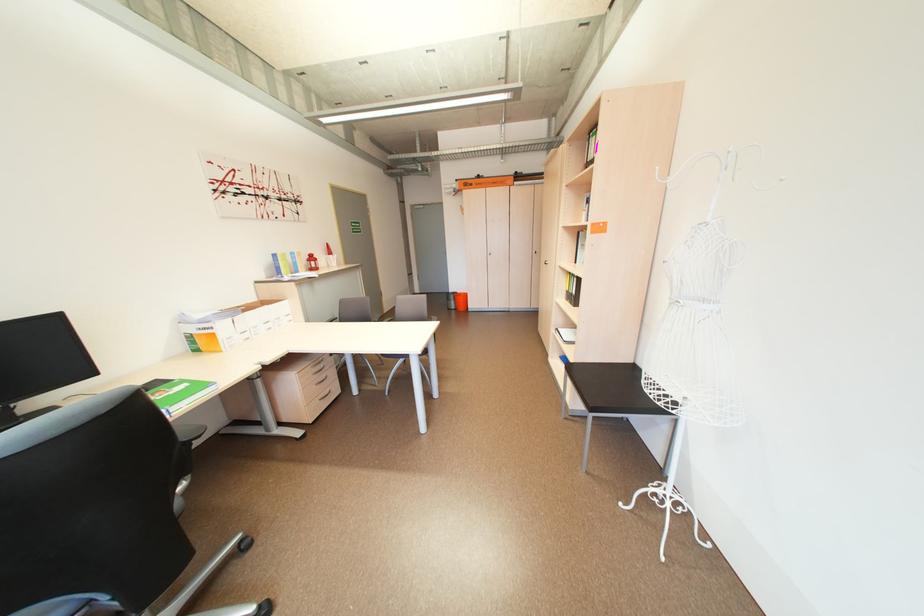
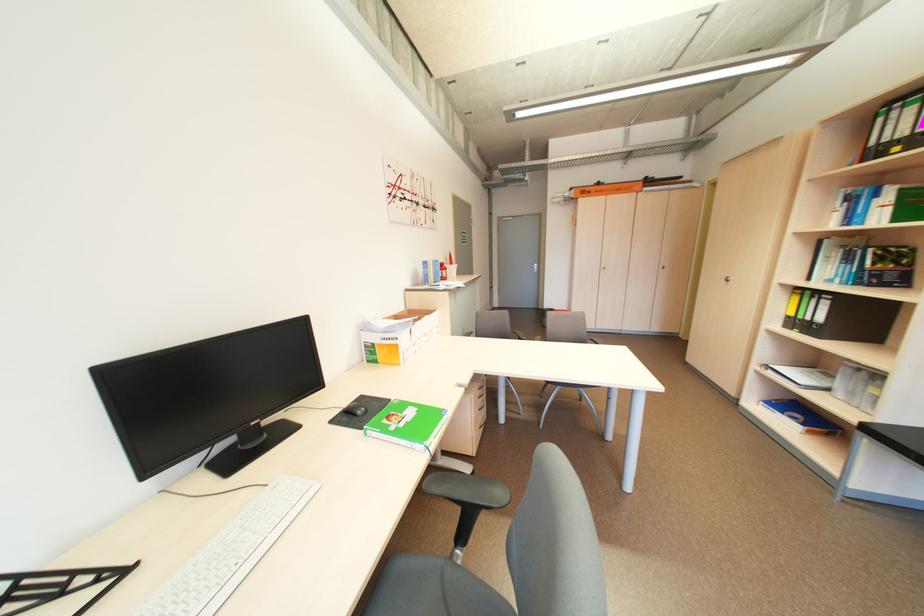
Question: Which direction would the cameraman need to move to produce the second image? Reply with the corresponding letter.

Choices:
 (A) Left
 (B) Right
 (C) Forward
 (D) Backward

Answer: (A)